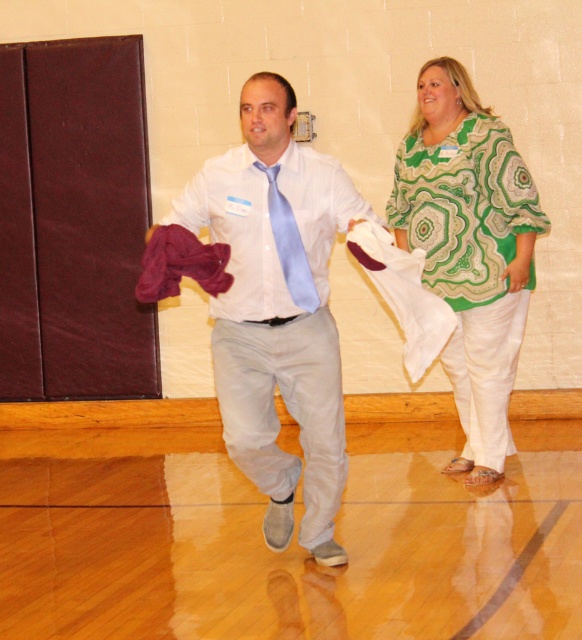
You are organizing a charity clothing drive and need to determine which items can fit into a standard donation box that accommodates garments up to the size of the light gray cotton shirt at center. Can the green paisley blouse at right fit into the box?

The light gray cotton shirt at center is larger in size than the green paisley blouse at right, so the green paisley blouse at right can fit into the donation box since it is smaller than the maximum size allowed.

You are a photographer setting up for a photoshoot in the gymnasium. You need to position a light source so that it illuminates both the light gray cotton shirt at center and the green paisley blouse at right equally. Considering their positions, which direction should you place the light source to ensure both are well lit?

The light gray cotton shirt at center is in front of the green paisley blouse at right. To ensure both are equally illuminated, the light source should be placed behind the green paisley blouse at right so that the light can reach both garments without being blocked by the overlapping positions.

You are a photographer positioned at the origin point of the coordinate system. You want to capture a closeup shot of the green paisley blouse at right. What are the coordinates you should aim your camera at?

The coordinates to aim the camera at are (x=470, y=248) to capture the green paisley blouse at right.